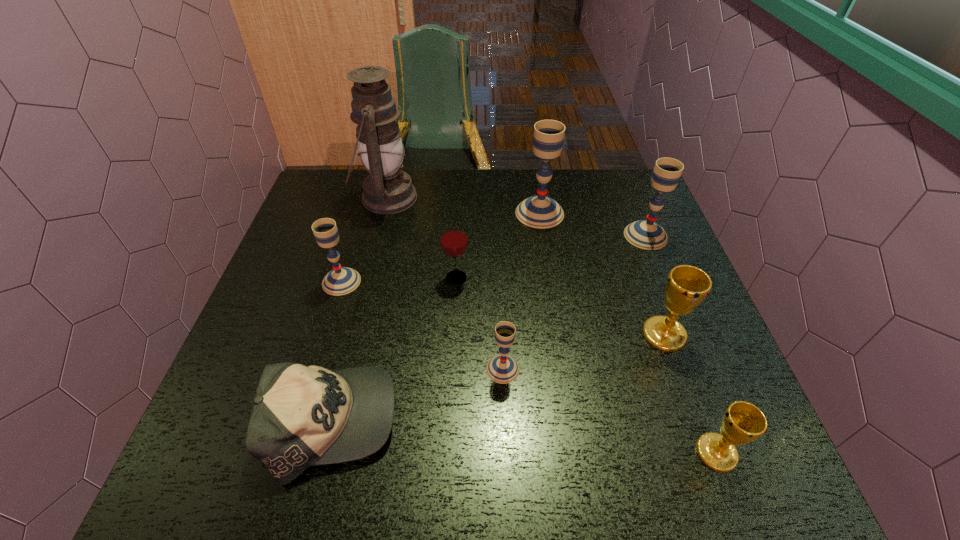
Identify the location of oil lamp. This screenshot has height=540, width=960. (386, 190).

Locate an element on the screen. The height and width of the screenshot is (540, 960). the tallest object is located at coordinates (x=386, y=190).

Find the location of a particular element. the fourth chalice from right to left is located at coordinates (539, 211).

Where is `the sixth object from left to right`? This screenshot has width=960, height=540. the sixth object from left to right is located at coordinates (539, 211).

Find the location of `the rightmost gray chalice`. the rightmost gray chalice is located at coordinates (646, 234).

Find the location of a particular element. This screenshot has height=540, width=960. the second tallest chalice is located at coordinates (646, 234).

I want to click on the leftmost chalice, so click(x=341, y=280).

Where is `the leftmost gray chalice`? The image size is (960, 540). the leftmost gray chalice is located at coordinates (341, 280).

Locate an element on the screen. The height and width of the screenshot is (540, 960). the bigger gold chalice is located at coordinates (687, 286).

The image size is (960, 540). I want to click on the fourth farthest chalice, so click(x=687, y=286).